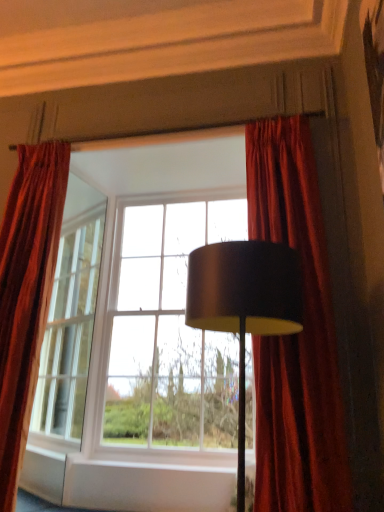
Question: In terms of width, does matte black lampshade at center look wider or thinner when compared to velvet red curtain at right, placed as the second curtain when sorted from left to right?

Choices:
 (A) wide
 (B) thin

Answer: (A)

Question: Considering the positions of matte black lampshade at center and velvet red curtain at right, arranged as the 1th curtain when viewed from the right, in the image, is matte black lampshade at center taller or shorter than velvet red curtain at right, arranged as the 1th curtain when viewed from the right,?

Choices:
 (A) tall
 (B) short

Answer: (B)

Question: Based on their relative distances, which object is farther from the velvet red curtain at right, placed as the second curtain when sorted from left to right?

Choices:
 (A) matte black lampshade at center
 (B) velvet red curtain at left, which appears as the 2th curtain when viewed from the right
 (C) matte glass window at center

Answer: (B)

Question: Estimate the real-world distances between objects in this image. Which object is farther from the matte glass window at center?

Choices:
 (A) velvet red curtain at right, placed as the second curtain when sorted from left to right
 (B) matte black lampshade at center
 (C) velvet red curtain at left, which appears as the 2th curtain when viewed from the right

Answer: (B)